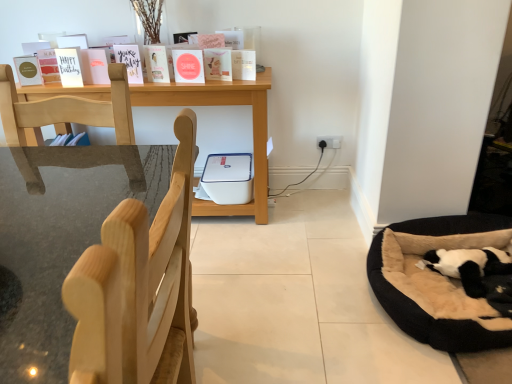
At what (x,y) coordinates should I click in order to perform the action: click on vacant space positioned to the left of black plush dog bed at lower right. Please return your answer as a coordinate pair (x, y). Looking at the image, I should click on (309, 301).